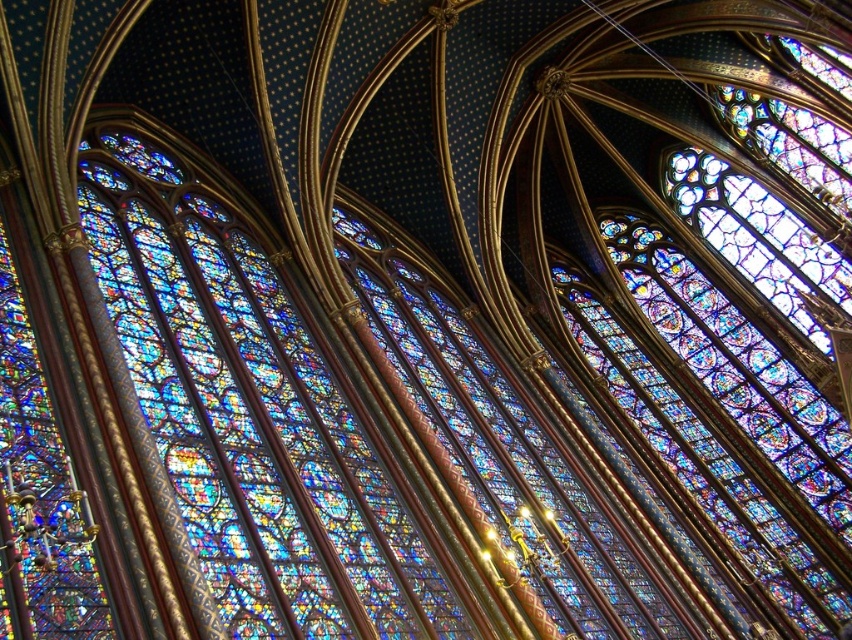
Question: Is multicolored stained glass window at center wider than stained glass window at center?

Choices:
 (A) yes
 (B) no

Answer: (B)

Question: Can you confirm if multicolored stained glass window at center is positioned above stained glass window at center?

Choices:
 (A) yes
 (B) no

Answer: (A)

Question: Is multicolored stained glass window at center below stained glass window at center?

Choices:
 (A) yes
 (B) no

Answer: (B)

Question: Among these objects, which one is nearest to the camera?

Choices:
 (A) multicolored stained glass window at center
 (B) stained glass window at center

Answer: (A)